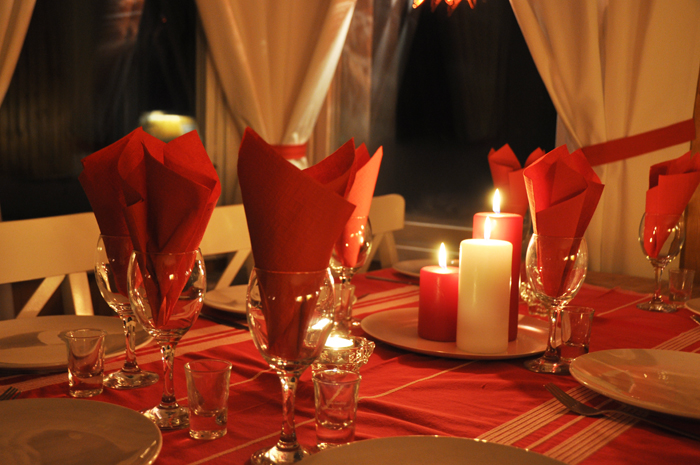
At what (x,y) coordinates should I click in order to perform the action: click on chair pieces. Please return your answer as a coordinate pair (x, y). Looking at the image, I should click on (82, 289), (41, 295), (50, 256), (229, 268), (232, 237), (388, 254), (374, 250), (388, 221).